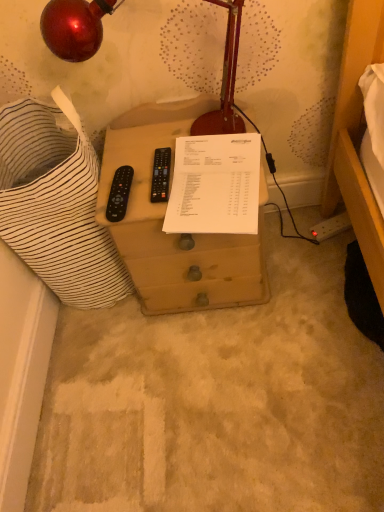
Locate an element on the screen. Image resolution: width=384 pixels, height=512 pixels. white paper at center is located at coordinates (215, 185).

The height and width of the screenshot is (512, 384). What do you see at coordinates (174, 234) in the screenshot? I see `brown wooden drawer at center` at bounding box center [174, 234].

Where is `white paper at center`? This screenshot has width=384, height=512. white paper at center is located at coordinates (215, 185).

Does metallic red lamp at upper left turn towards brown wooden drawer at center?

No.

Which point is more distant from viewer, [94,24] or [175,284]?

The point [175,284] is farther from the camera.

Considering the relative positions of metallic red lamp at upper left and brown wooden drawer at center in the image provided, is metallic red lamp at upper left in front of brown wooden drawer at center?

Yes, metallic red lamp at upper left is closer to the camera.

From a real-world perspective, which is physically below, metallic red lamp at upper left or brown wooden drawer at center?

brown wooden drawer at center, from a real-world perspective.

In the scene shown: Is white paper at center surrounded by metallic red lamp at upper left?

No, metallic red lamp at upper left does not contain white paper at center.

Between metallic red lamp at upper left and white paper at center, which one appears on the right side from the viewer's perspective?

white paper at center.

Are metallic red lamp at upper left and white paper at center beside each other?

metallic red lamp at upper left and white paper at center are not in contact.

Between white paper at center and metallic red lamp at upper left, which one is positioned in front?

metallic red lamp at upper left.

In terms of size, does white paper at center appear bigger or smaller than metallic red lamp at upper left?

Considering their sizes, white paper at center takes up less space than metallic red lamp at upper left.

Which of these two, white paper at center or metallic red lamp at upper left, stands shorter?

white paper at center is shorter.

Considering the relative sizes of white paper at center and metallic red lamp at upper left in the image provided, is white paper at center wider than metallic red lamp at upper left?

Yes.

Which object is further away from the camera taking this photo, brown wooden drawer at center or metallic red lamp at upper left?

brown wooden drawer at center is more distant.

Can you confirm if brown wooden drawer at center is positioned to the left of metallic red lamp at upper left?

No.

From the image's perspective, which object appears higher, brown wooden drawer at center or metallic red lamp at upper left?

metallic red lamp at upper left, from the image's perspective.

Considering the relative positions of white paper at center and brown wooden drawer at center in the image provided, is white paper at center to the left of brown wooden drawer at center from the viewer's perspective?

In fact, white paper at center is to the right of brown wooden drawer at center.

From a real-world perspective, is white paper at center positioned above or below brown wooden drawer at center?

white paper at center is above brown wooden drawer at center.

Considering the relative sizes of white paper at center and brown wooden drawer at center in the image provided, is white paper at center wider than brown wooden drawer at center?

Incorrect, the width of white paper at center does not surpass that of brown wooden drawer at center.

Where is `document above the brown wooden drawer at center (from the image's perspective)`? The width and height of the screenshot is (384, 512). document above the brown wooden drawer at center (from the image's perspective) is located at coordinates (215, 185).

Is brown wooden drawer at center positioned with its back to white paper at center?

No, white paper at center is not at the back of brown wooden drawer at center.

Is brown wooden drawer at center next to white paper at center?

No, brown wooden drawer at center is not in contact with white paper at center.

Considering the sizes of objects brown wooden drawer at center and white paper at center in the image provided, who is bigger, brown wooden drawer at center or white paper at center?

brown wooden drawer at center.

Consider the image. Is the position of brown wooden drawer at center less distant than that of white paper at center?

That is False.

The width and height of the screenshot is (384, 512). Identify the location of lamp in front of the brown wooden drawer at center. (74, 27).

Image resolution: width=384 pixels, height=512 pixels. In order to click on document located behind the metallic red lamp at upper left in this screenshot , I will do (x=215, y=185).

From the image, which object appears to be farther from white paper at center, brown wooden drawer at center or metallic red lamp at upper left?

The object further to white paper at center is metallic red lamp at upper left.

Which object lies nearer to the anchor point metallic red lamp at upper left, brown wooden drawer at center or white paper at center?

white paper at center is closer to metallic red lamp at upper left.

When comparing their distances from brown wooden drawer at center, does metallic red lamp at upper left or white paper at center seem further?

metallic red lamp at upper left lies further to brown wooden drawer at center than the other object.

In the scene shown: Which object lies further to the anchor point metallic red lamp at upper left, white paper at center or brown wooden drawer at center?

Among the two, brown wooden drawer at center is located further to metallic red lamp at upper left.

When comparing their distances from brown wooden drawer at center, does white paper at center or metallic red lamp at upper left seem closer?

The object closer to brown wooden drawer at center is white paper at center.

When comparing their distances from white paper at center, does metallic red lamp at upper left or brown wooden drawer at center seem further?

metallic red lamp at upper left.

Image resolution: width=384 pixels, height=512 pixels. Identify the location of document between metallic red lamp at upper left and brown wooden drawer at center from top to bottom. (215, 185).